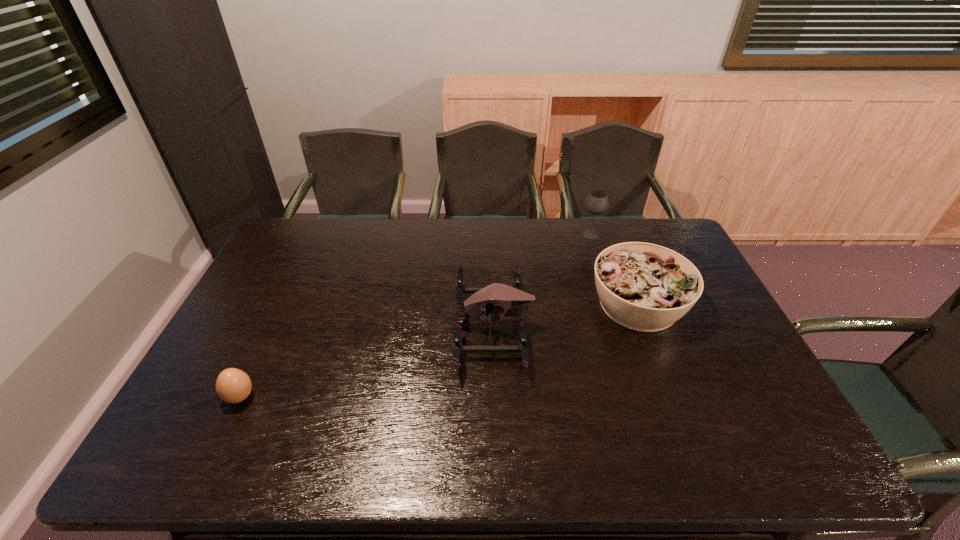
Image resolution: width=960 pixels, height=540 pixels. In order to click on the tallest object in this screenshot , I will do `click(596, 202)`.

The width and height of the screenshot is (960, 540). I want to click on the farthest object, so click(596, 202).

This screenshot has width=960, height=540. I want to click on salad, so click(x=644, y=287).

The image size is (960, 540). Identify the location of the third object from right to left. (509, 299).

Find the location of `boiled egg`. boiled egg is located at coordinates (233, 385).

The height and width of the screenshot is (540, 960). I want to click on the shortest object, so click(x=233, y=385).

Image resolution: width=960 pixels, height=540 pixels. What are the coordinates of `free region located on the front of the farthest object` in the screenshot? It's located at (601, 266).

I want to click on vacant region located 0.070m on the left of the salad, so click(x=565, y=305).

Identify the location of vacant space located 0.220m on the front-facing side of the drone. (379, 326).

You are a GUI agent. You are given a task and a screenshot of the screen. Output one action in this format:
    pyautogui.click(x=<x>, y=<y>)
    Task: Click on the vacant space located 0.360m on the front-facing side of the drone
    The width and height of the screenshot is (960, 540).
    Given the screenshot: What is the action you would take?
    pyautogui.click(x=330, y=326)